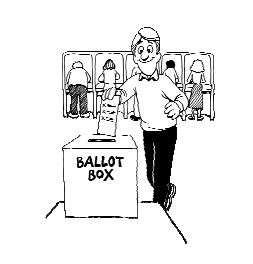
Where is `white surface of table`? The image size is (253, 264). white surface of table is located at coordinates (124, 227).